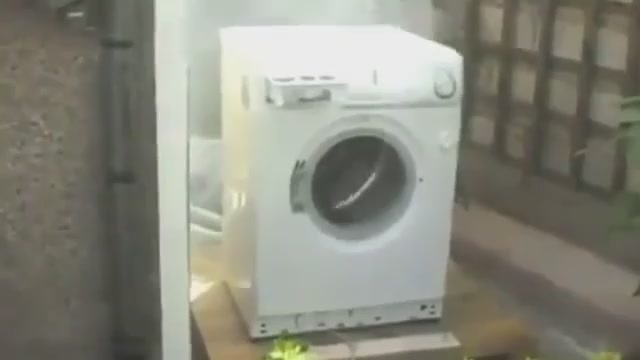
Find the location of a particular element. The image size is (640, 360). wall is located at coordinates (72, 141).